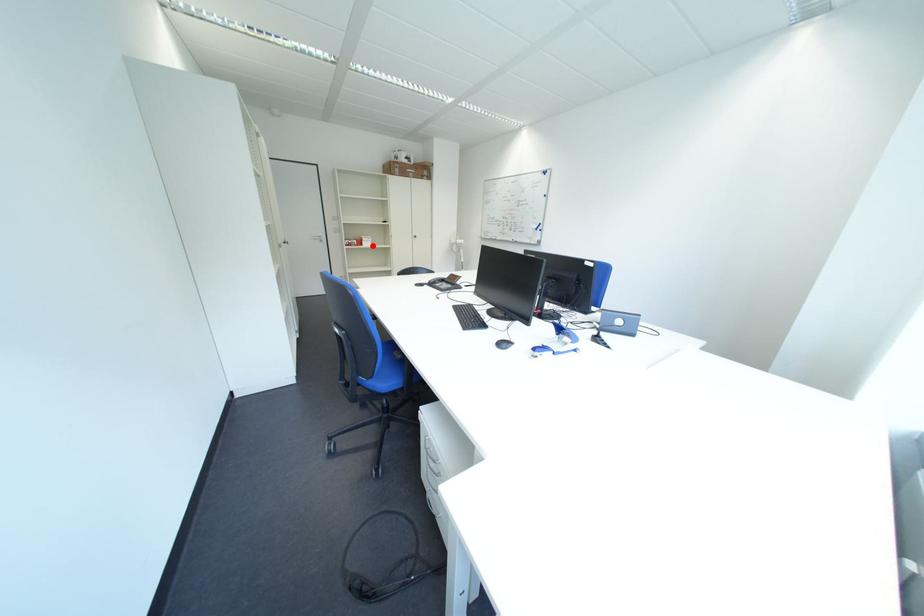
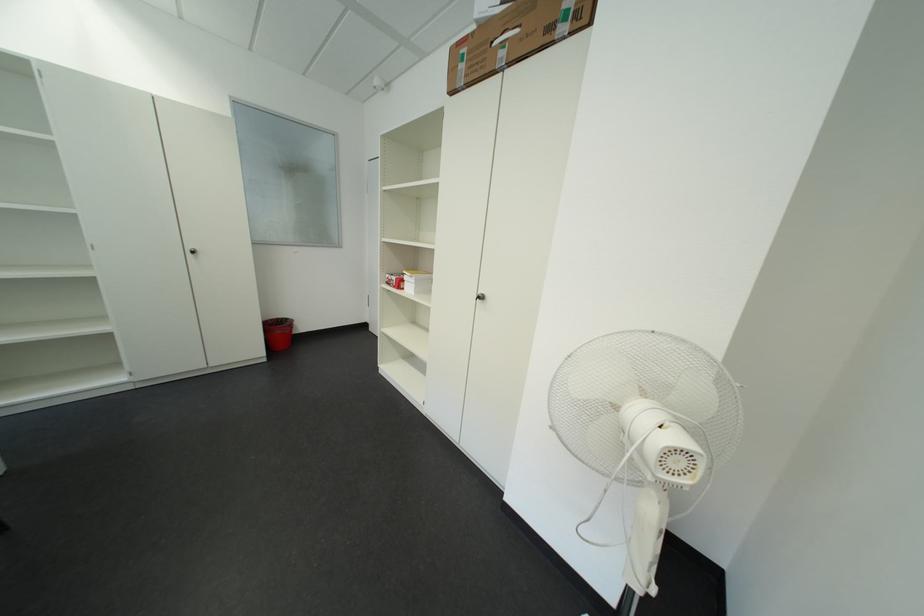
Question: I am providing you with two images of the same scene from different viewpoints. A red point is marked on the first image. Is the red point's position out of view in image 2?

Choices:
 (A) Yes
 (B) No

Answer: (B)